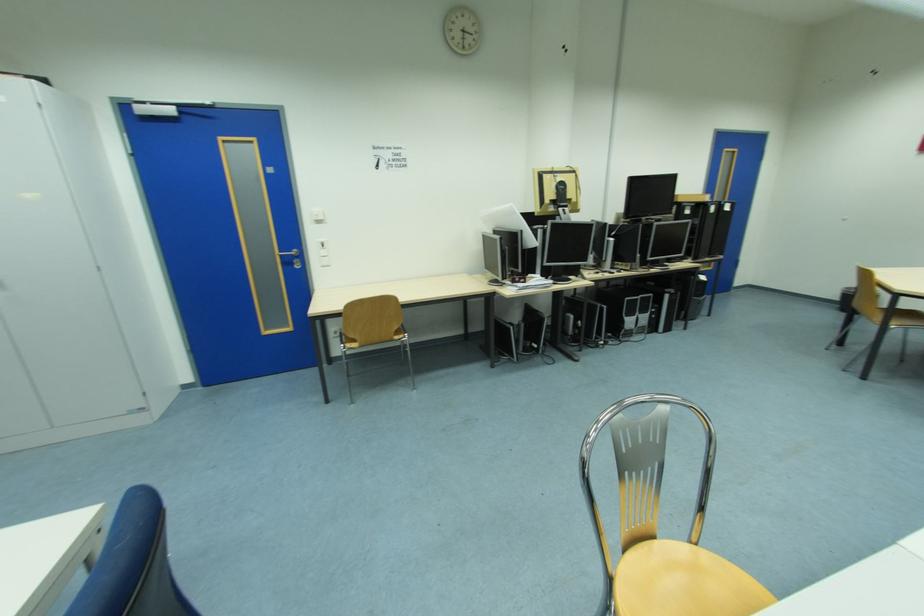
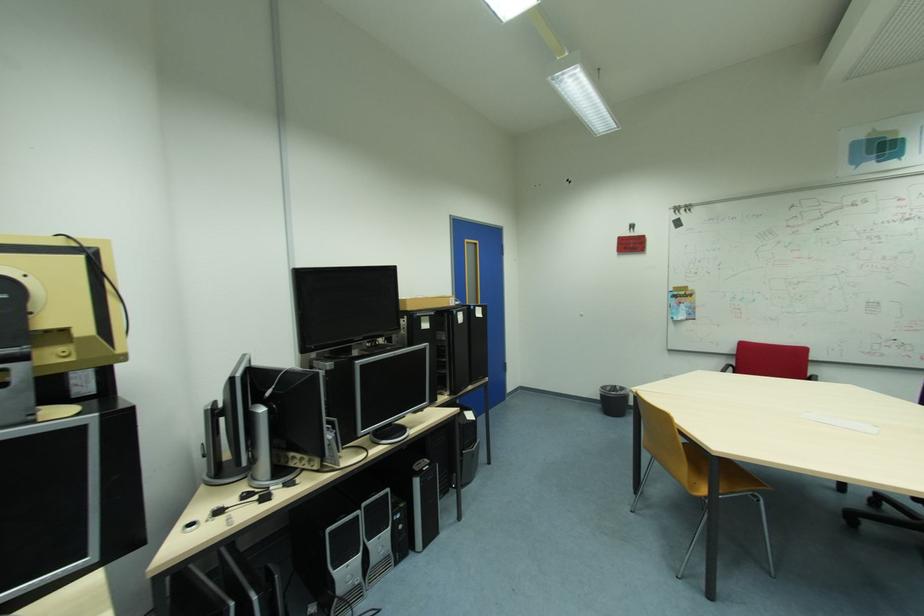
Where in the second image is the point corresponding to pixel 732 151 from the first image?

(473, 241)